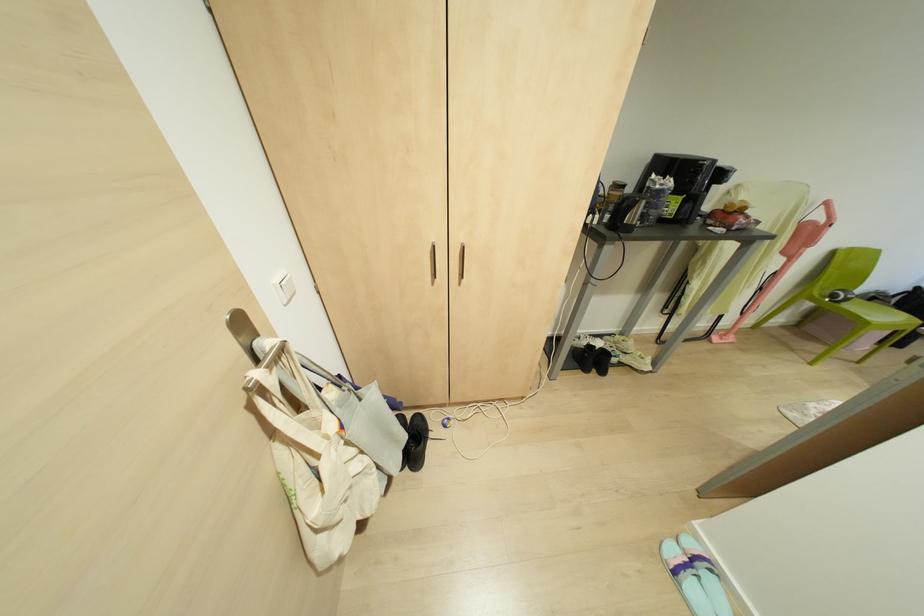
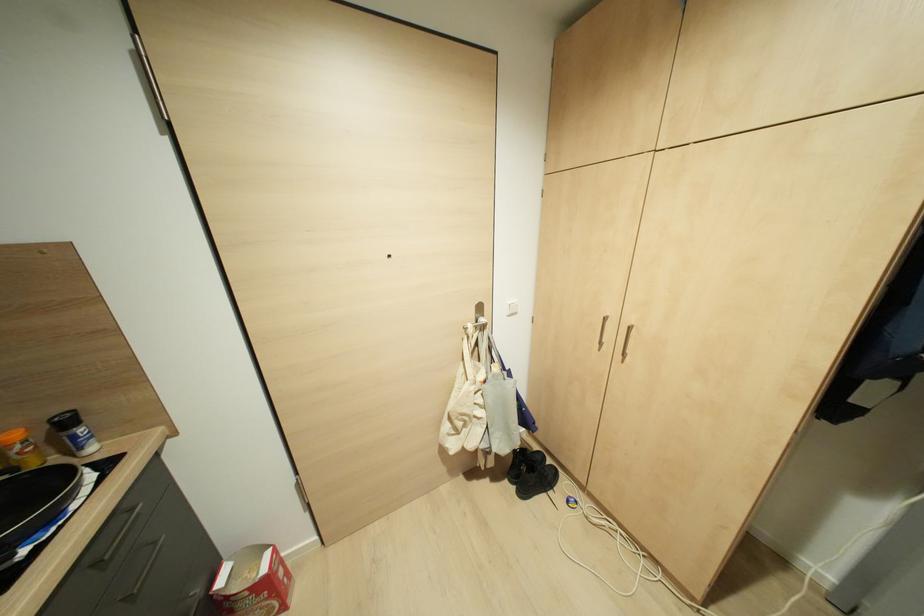
Question: The images are taken continuously from a first-person perspective. In which direction is your viewpoint rotating?

Choices:
 (A) Left
 (B) Right
 (C) Up
 (D) Down

Answer: (A)